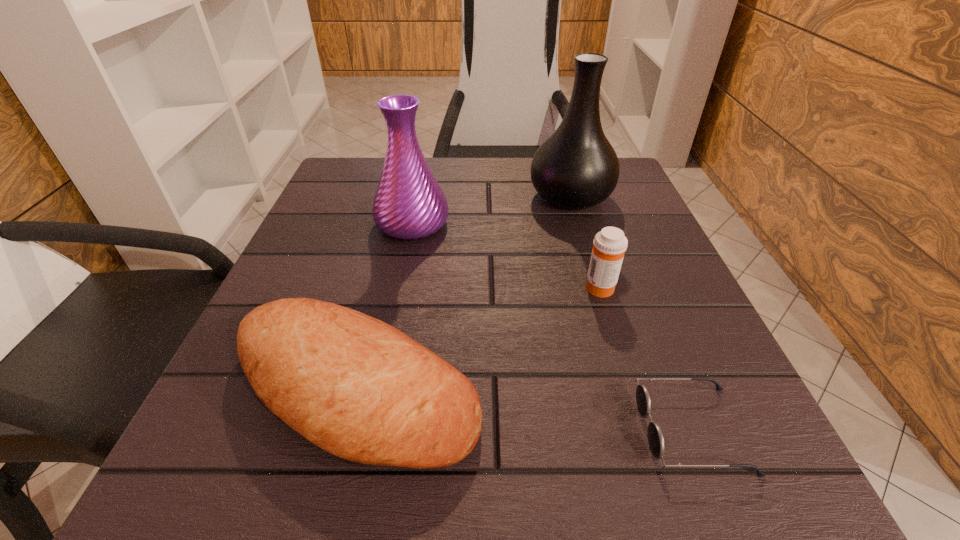
I want to click on object present at the far left corner, so click(x=409, y=204).

The height and width of the screenshot is (540, 960). I want to click on object that is at the near left corner, so click(358, 388).

Locate an element on the screen. Image resolution: width=960 pixels, height=540 pixels. object positioned at the far right corner is located at coordinates (576, 167).

Where is `object at the near right corner`? object at the near right corner is located at coordinates (655, 436).

Where is `blank space at the far edge of the desktop`? The width and height of the screenshot is (960, 540). blank space at the far edge of the desktop is located at coordinates (484, 190).

This screenshot has width=960, height=540. What are the coordinates of `vacant space at the near edge of the desktop` in the screenshot? It's located at (344, 484).

This screenshot has height=540, width=960. In the image, there is a desktop. What are the coordinates of `free space at the left edge` in the screenshot? It's located at (336, 257).

The height and width of the screenshot is (540, 960). Find the location of `free space at the right edge`. free space at the right edge is located at coordinates (636, 232).

In the image, there is a desktop. Where is `free space at the far left corner`? free space at the far left corner is located at coordinates (343, 205).

Locate an element on the screen. This screenshot has height=540, width=960. free space between the medicine and the left vase is located at coordinates (506, 255).